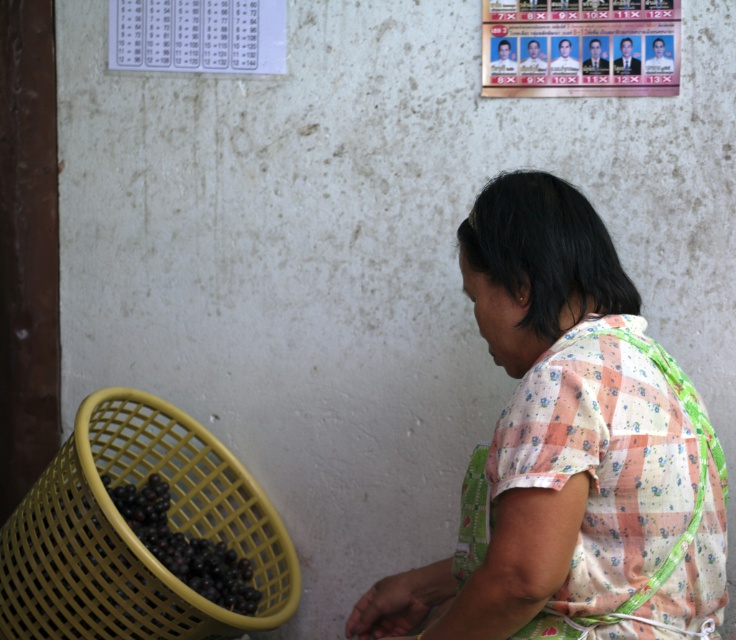
Based on the photo, you are a delivery person who needs to place a small package between the white checkered shirt at center and the shiny purple grapes at lower left. The package requires 30 inches of space. Can you fit it there?

The distance between the white checkered shirt at center and the shiny purple grapes at lower left is 33.77 inches, which is more than enough to fit the 30 inch package between them.